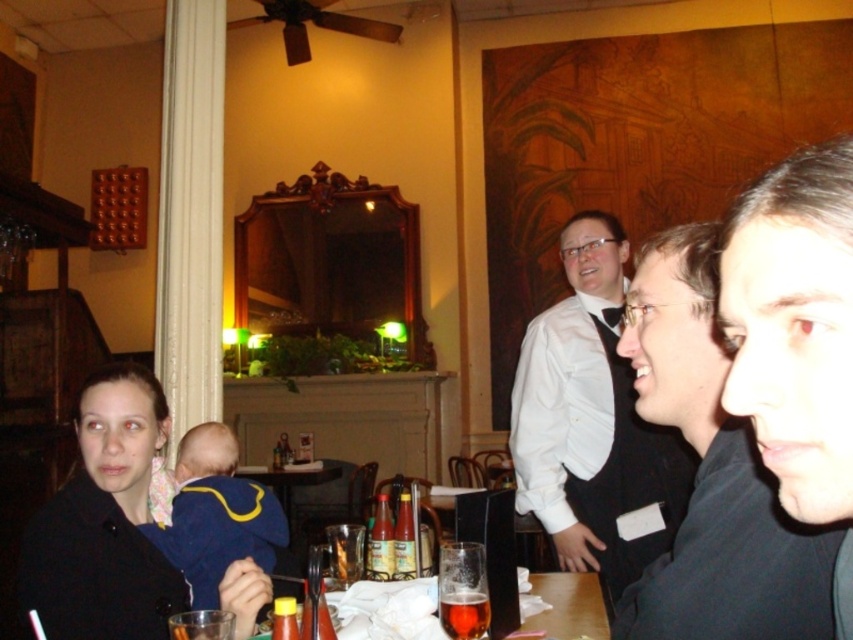
Question: From the image, what is the correct spatial relationship of white shirt at upper center in relation to amber glass beer at lower center?

Choices:
 (A) below
 (B) above

Answer: (B)

Question: Can you confirm if blue fleece jacket at lower left is positioned below amber glass beer at lower center?

Choices:
 (A) no
 (B) yes

Answer: (B)

Question: Estimate the real-world distances between objects in this image. Which object is closer to the amber glass beer at lower center?

Choices:
 (A) black matte shirt at right
 (B) white shirt at upper center
 (C) blue fleece jacket at lower left

Answer: (A)

Question: Is blue fleece jacket at lower left to the right of amber glass beer at lower center from the viewer's perspective?

Choices:
 (A) no
 (B) yes

Answer: (A)

Question: Among these points, which one is nearest to the camera?

Choices:
 (A) (467, 636)
 (B) (561, 456)

Answer: (A)

Question: Which point is farther to the camera?

Choices:
 (A) (643, 432)
 (B) (474, 627)
 (C) (144, 532)
 (D) (659, 378)

Answer: (A)